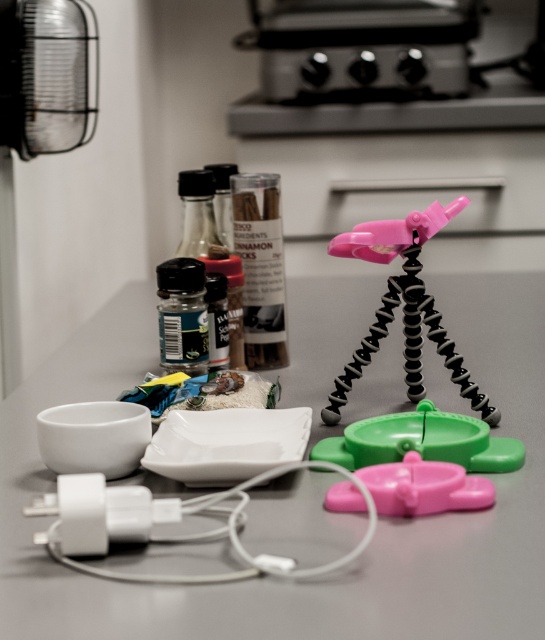
Question: Which object is the closest to the black glass spice at center?

Choices:
 (A) pink matte tripod at center
 (B) white glossy table at center

Answer: (A)

Question: Which point is farther from the camera taking this photo?

Choices:
 (A) (269, 566)
 (B) (414, 445)
 (C) (341, 252)
 (D) (196, 212)

Answer: (D)

Question: Is pink rubber toy at center above black matte spice bottle at center?

Choices:
 (A) no
 (B) yes

Answer: (A)

Question: Which object is the farthest from the green matte spice bottle at center?

Choices:
 (A) green plastic toy at center
 (B) pink matte tripod at center
 (C) black matte spice bottle at center

Answer: (A)

Question: Is pink matte tripod at center to the left of black matte spice bottle at center from the viewer's perspective?

Choices:
 (A) yes
 (B) no

Answer: (B)

Question: Is white plastic charger at lower left wider than green matte spice bottle at center?

Choices:
 (A) yes
 (B) no

Answer: (A)